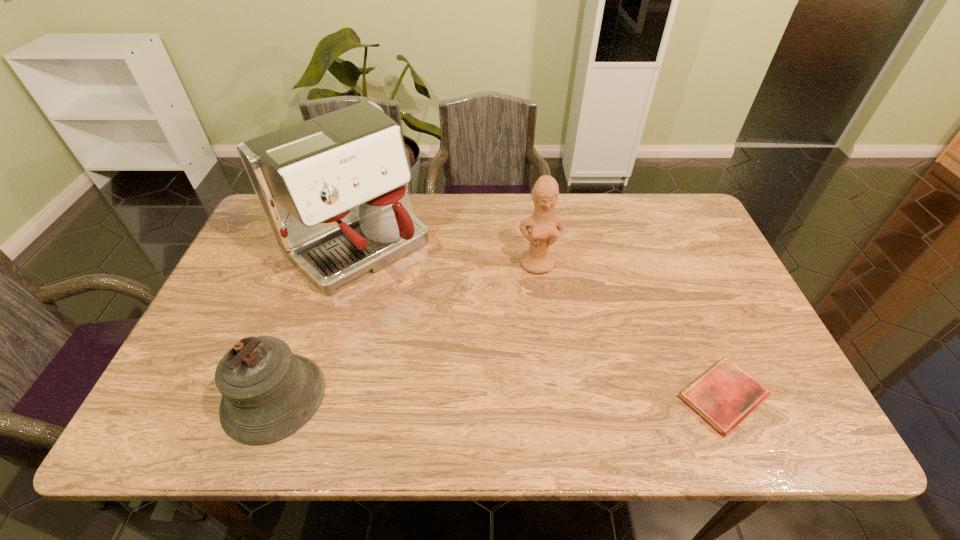
Identify the location of the second shortest object. The image size is (960, 540). coord(268,393).

Find the location of a particular element. The image size is (960, 540). diary is located at coordinates (723, 396).

Find the location of a particular element. the shortest object is located at coordinates (723, 396).

The height and width of the screenshot is (540, 960). I want to click on the tallest object, so click(x=332, y=189).

Identify the location of the third shortest object. This screenshot has height=540, width=960. (546, 228).

You are a GUI agent. You are given a task and a screenshot of the screen. Output one action in this format:
    pyautogui.click(x=<x>, y=<y>)
    Task: Click on the figurine
    This screenshot has height=540, width=960.
    Given the screenshot: What is the action you would take?
    pyautogui.click(x=546, y=228)

The width and height of the screenshot is (960, 540). I want to click on vacant space located 0.300m on the right of the third tallest object, so 457,397.

Find the location of `free space located 0.140m on the back of the shortest object`. free space located 0.140m on the back of the shortest object is located at coordinates (688, 314).

At what (x,y) coordinates should I click in order to perform the action: click on free spot located 0.390m on the front of the tallest object near the spout. Please return your answer as a coordinate pair (x, y). The height and width of the screenshot is (540, 960). Looking at the image, I should click on (491, 374).

This screenshot has width=960, height=540. I want to click on vacant space situated on the front of the tallest object near the spout, so [x=429, y=314].